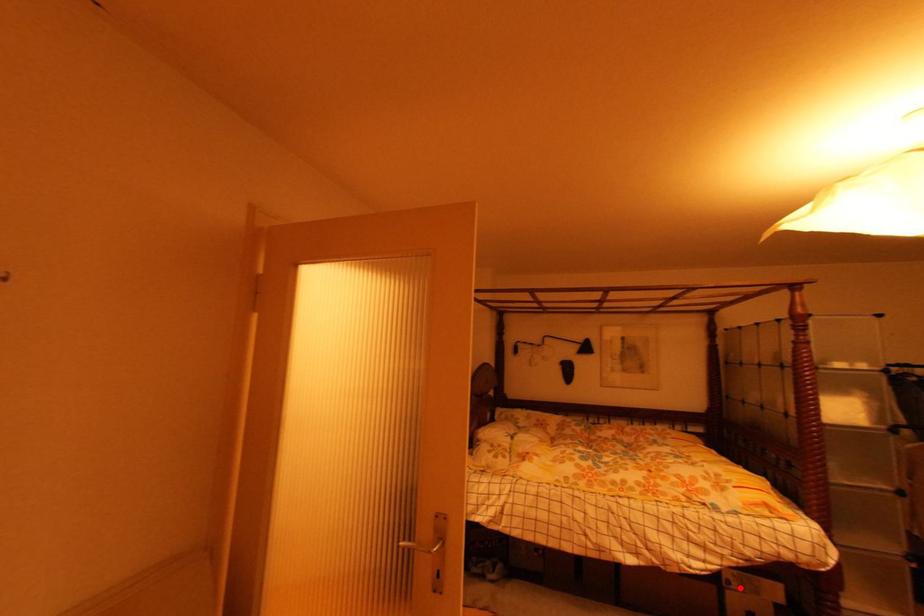
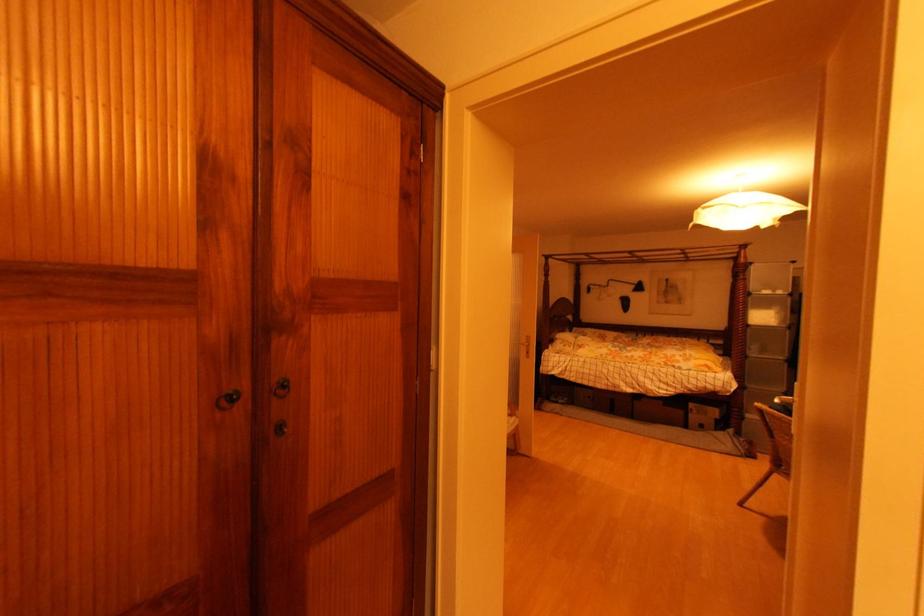
Find the pixel in the second image that matches the highlighted location in the first image.

(699, 413)